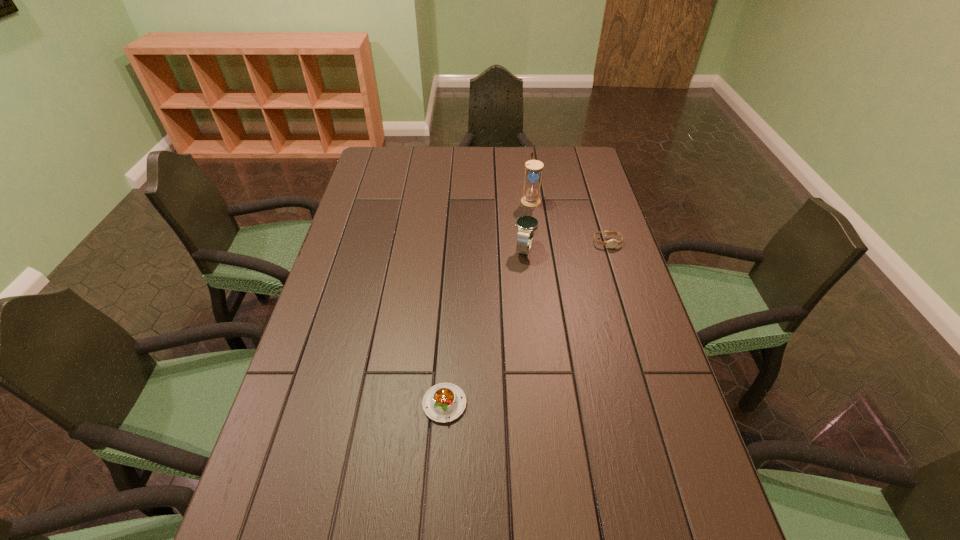
Identify the location of hourglass. This screenshot has height=540, width=960. (531, 198).

The width and height of the screenshot is (960, 540). Find the location of `the tallest object`. the tallest object is located at coordinates (531, 198).

Identify the location of the third shortest object. (526, 225).

At what (x,y) coordinates should I click in order to perform the action: click on the left watch. Please return your answer as a coordinate pair (x, y). Looking at the image, I should click on (526, 225).

This screenshot has height=540, width=960. I want to click on the rightmost object, so click(612, 243).

Image resolution: width=960 pixels, height=540 pixels. What are the coordinates of `the shorter watch` in the screenshot? It's located at (612, 243).

Identify the location of the nearest object. (444, 402).

Image resolution: width=960 pixels, height=540 pixels. Identify the location of the leftmost object. (444, 402).

Find the location of a particular element. vacant area situated on the left of the farthest object is located at coordinates (422, 200).

You are a GUI agent. You are given a task and a screenshot of the screen. Output one action in this format:
    pyautogui.click(x=<x>, y=<y>)
    Task: Click on the vacant region located on the front of the taller watch
    This screenshot has width=960, height=540.
    Given the screenshot: What is the action you would take?
    pyautogui.click(x=534, y=336)